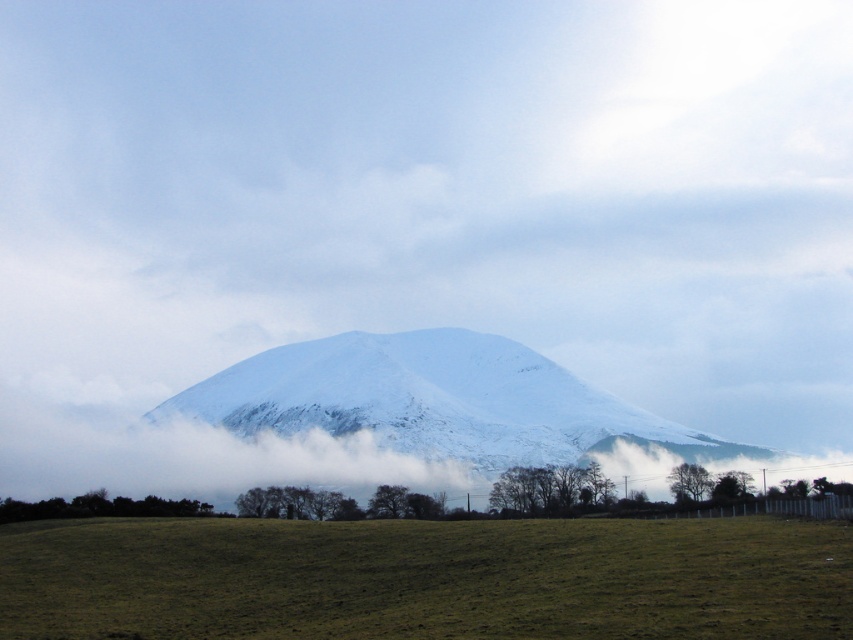
You are standing at the point marked as point (426, 577) in the image. Based on the scene description, what would you see immediately in front of you?

You would see the green grassy field at lower center immediately in front of you, as the point (426, 577) corresponds to that location.

You are standing at the center of the image and want to walk towards the green grassy field at lower center. In which direction should you move?

The green grassy field at lower center is located at point (426,577), which is slightly to the right and directly below the center. Therefore, you should move downward and slightly to the right to reach it.